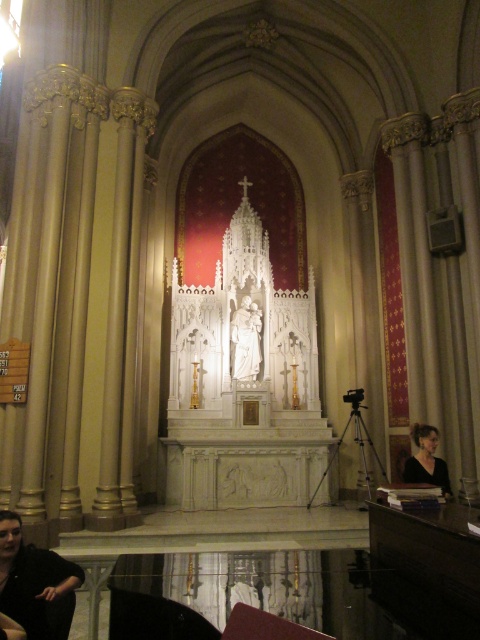
Who is taller, black fabric woman at lower left or black matte dress at lower right?

black fabric woman at lower left

Locate an element on the screen. The image size is (480, 640). black fabric woman at lower left is located at coordinates (36, 582).

This screenshot has height=640, width=480. Identify the location of black fabric woman at lower left. (36, 582).